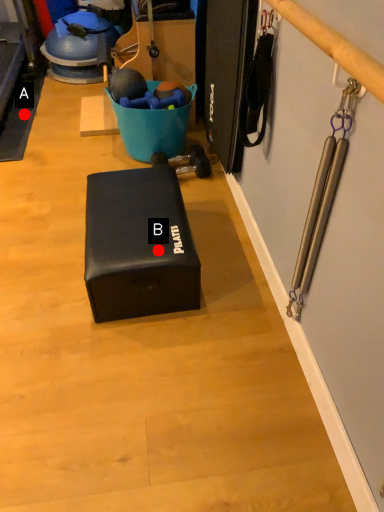
Question: Two points are circled on the image, labeled by A and B beside each circle. Which point appears farthest from the camera in this image?

Choices:
 (A) A is further
 (B) B is further

Answer: (A)